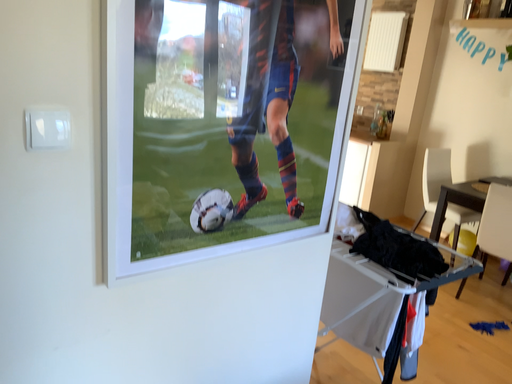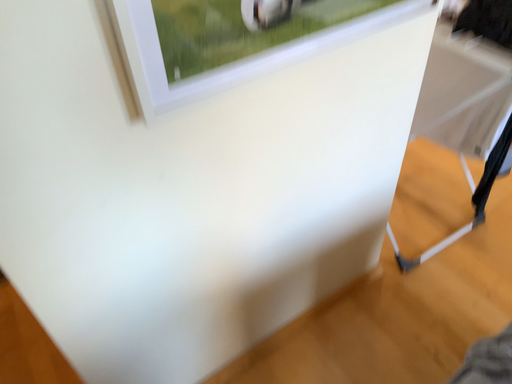
Question: Which way did the camera rotate in the video?

Choices:
 (A) rotated downward
 (B) rotated upward

Answer: (A)